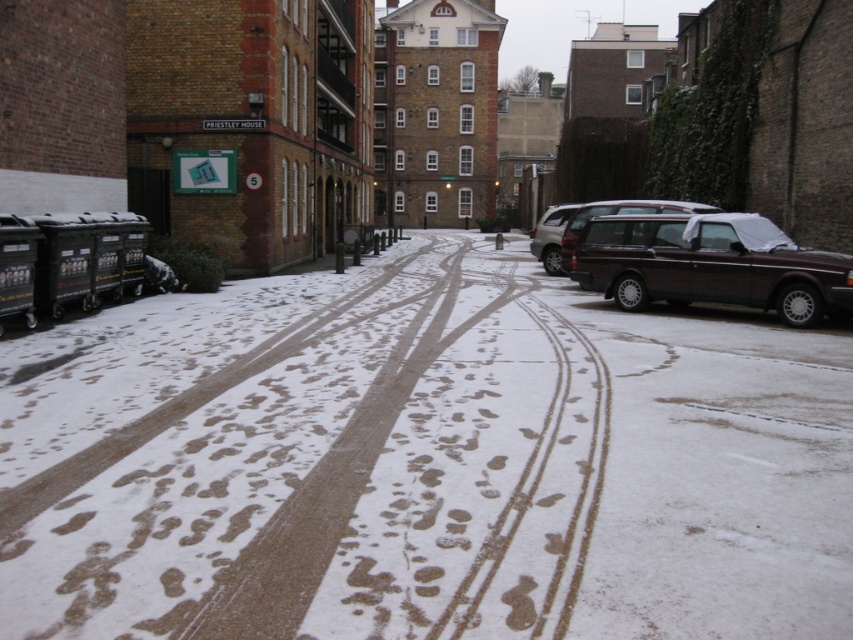
You are a delivery person trying to park your 15 feet long delivery van in the snowy alleyway. You see the maroon metallic station wagon at right. Can you fit your van between the station wagon and the trash bins on the left?

The maroon metallic station wagon at right is 38.43 feet from the camera. Since the van is 15 feet long, there might be enough space between the station wagon and the trash bins, but the exact distance between them isn